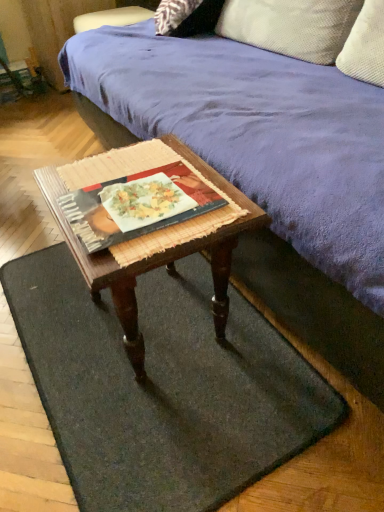
What do you see at coordinates (291, 26) in the screenshot? The height and width of the screenshot is (512, 384). I see `textured beige pillow at upper right` at bounding box center [291, 26].

Describe the element at coordinates (153, 233) in the screenshot. The image size is (384, 512). I see `woven wood coffee table at center` at that location.

This screenshot has height=512, width=384. I want to click on woven wood coffee table at center, so click(x=153, y=233).

The height and width of the screenshot is (512, 384). What do you see at coordinates (162, 388) in the screenshot?
I see `green felt doormat at lower center` at bounding box center [162, 388].

Describe the element at coordinates (137, 205) in the screenshot. I see `matte black book at center` at that location.

The image size is (384, 512). I want to click on textured beige pillow at upper right, so click(x=291, y=26).

In the scene shown: Does green felt doormat at lower center come in front of purple suede couch at upper center?

That is False.

Would you say green felt doormat at lower center is to the left or to the right of purple suede couch at upper center in the picture?

green felt doormat at lower center is positioned on purple suede couch at upper center's left side.

How far apart are green felt doormat at lower center and purple suede couch at upper center?

green felt doormat at lower center and purple suede couch at upper center are 17.68 inches apart from each other.

From the image's perspective, which is below, green felt doormat at lower center or purple suede couch at upper center?

From the image's view, green felt doormat at lower center is below.

From the image's perspective, which is below, green felt doormat at lower center or matte black book at center?

From the image's view, green felt doormat at lower center is below.

From a real-world perspective, is green felt doormat at lower center under matte black book at center?

Indeed, from a real-world perspective, green felt doormat at lower center is positioned beneath matte black book at center.

Is green felt doormat at lower center closer to camera compared to matte black book at center?

Yes, green felt doormat at lower center is in front of matte black book at center.

Can we say green felt doormat at lower center lies outside matte black book at center?

That's correct, green felt doormat at lower center is outside of matte black book at center.

Is point (189, 150) closer to viewer compared to point (378, 186)?

That is False.

Is woven wood coffee table at center oriented away from purple suede couch at upper center?

Yes, woven wood coffee table at center's orientation is away from purple suede couch at upper center.

Can you tell me how much woven wood coffee table at center and purple suede couch at upper center differ in facing direction?

The facing directions of woven wood coffee table at center and purple suede couch at upper center are 2.83 degrees apart.

Based on the photo, from a real-world perspective, is textured beige pillow at upper right positioned under green felt doormat at lower center based on gravity?

Actually, textured beige pillow at upper right is physically above green felt doormat at lower center in the real world.

Between point (286, 51) and point (241, 352), which one is positioned behind?

Positioned behind is point (286, 51).

Is green felt doormat at lower center a part of textured beige pillow at upper right?

No, textured beige pillow at upper right does not contain green felt doormat at lower center.

Considering the positions of objects textured beige pillow at upper right and green felt doormat at lower center in the image provided, who is more to the right, textured beige pillow at upper right or green felt doormat at lower center?

textured beige pillow at upper right is more to the right.

Considering the points (183, 194) and (218, 218), which point is behind, point (183, 194) or point (218, 218)?

Positioned behind is point (183, 194).

From their relative heights in the image, would you say matte black book at center is taller or shorter than woven wood coffee table at center?

Considering their sizes, matte black book at center has less height than woven wood coffee table at center.

From the image's perspective, relative to woven wood coffee table at center, is matte black book at center above or below?

From the image's perspective, matte black book at center appears above woven wood coffee table at center.

From the picture: Is textured beige pillow at upper right at the back of woven wood coffee table at center?

No.

Relative to textured beige pillow at upper right, is woven wood coffee table at center in front or behind?

woven wood coffee table at center is in front of textured beige pillow at upper right.

In the scene shown: Is woven wood coffee table at center touching textured beige pillow at upper right?

There is a gap between woven wood coffee table at center and textured beige pillow at upper right.

Considering the positions of point (172, 230) and point (313, 15), is point (172, 230) closer or farther from the camera than point (313, 15)?

Point (172, 230) is positioned closer to the camera compared to point (313, 15).

Is woven wood coffee table at center at the back of green felt doormat at lower center?

green felt doormat at lower center does not have its back to woven wood coffee table at center.

Considering their positions, is green felt doormat at lower center located in front of or behind woven wood coffee table at center?

green felt doormat at lower center is behind woven wood coffee table at center.

Image resolution: width=384 pixels, height=512 pixels. In order to click on studio couch that appears in front of the green felt doormat at lower center in this screenshot , I will do `click(265, 168)`.

Locate an element on the screen. doormat below the matte black book at center (from a real-world perspective) is located at coordinates (162, 388).

Which object lies further to the anchor point matte black book at center, woven wood coffee table at center or textured beige pillow at upper right?

textured beige pillow at upper right lies further to matte black book at center than the other object.

Estimate the real-world distances between objects in this image. Which object is further from woven wood coffee table at center, matte black book at center or green felt doormat at lower center?

Among the two, green felt doormat at lower center is located further to woven wood coffee table at center.

When comparing their distances from matte black book at center, does purple suede couch at upper center or textured beige pillow at upper right seem further?

textured beige pillow at upper right is further to matte black book at center.

Based on their spatial positions, is woven wood coffee table at center or purple suede couch at upper center further from textured beige pillow at upper right?

woven wood coffee table at center.

When comparing their distances from textured beige pillow at upper right, does woven wood coffee table at center or matte black book at center seem further?

matte black book at center lies further to textured beige pillow at upper right than the other object.

Looking at the image, which one is located closer to green felt doormat at lower center, woven wood coffee table at center or purple suede couch at upper center?

woven wood coffee table at center is positioned closer to the anchor green felt doormat at lower center.

Estimate the real-world distances between objects in this image. Which object is closer to woven wood coffee table at center, green felt doormat at lower center or matte black book at center?

matte black book at center is closer to woven wood coffee table at center.

When comparing their distances from matte black book at center, does woven wood coffee table at center or purple suede couch at upper center seem further?

purple suede couch at upper center is positioned further to the anchor matte black book at center.

Identify the location of book between textured beige pillow at upper right and green felt doormat at lower center vertically. (137, 205).

The height and width of the screenshot is (512, 384). I want to click on book between purple suede couch at upper center and woven wood coffee table at center in the vertical direction, so click(x=137, y=205).

Identify the location of coffee table between purple suede couch at upper center and green felt doormat at lower center in the vertical direction. The height and width of the screenshot is (512, 384). (153, 233).

The image size is (384, 512). I want to click on coffee table that lies between matte black book at center and green felt doormat at lower center from top to bottom, so click(153, 233).